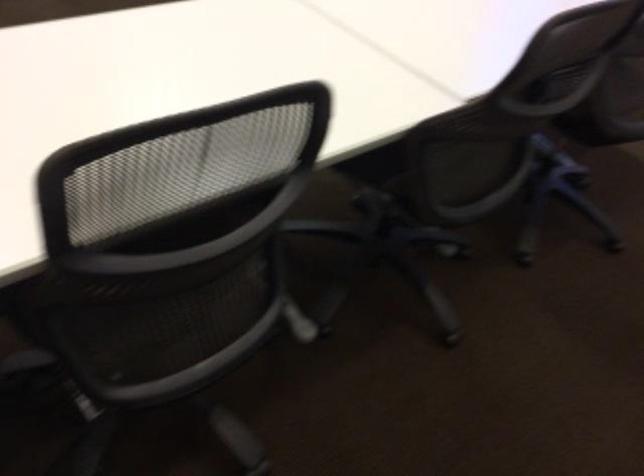
Find the location of a particular element. This screenshot has width=644, height=476. chair sitting surface is located at coordinates (448, 173).